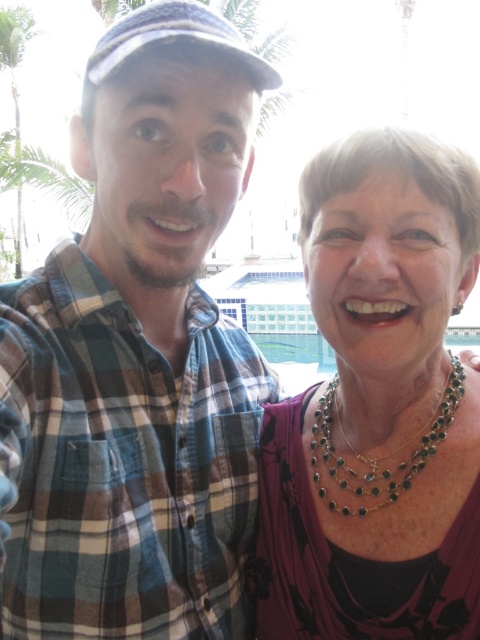
Is plaid fabric shirt at left to the right of multicolored beaded necklace at right from the viewer's perspective?

No, plaid fabric shirt at left is not to the right of multicolored beaded necklace at right.

At what (x,y) coordinates should I click in order to perform the action: click on plaid fabric shirt at left. Please return your answer as a coordinate pair (x, y). Looking at the image, I should click on (136, 355).

The image size is (480, 640). What are the coordinates of `plaid fabric shirt at left` in the screenshot? It's located at (136, 355).

Which is in front, point (9, 412) or point (330, 444)?

Point (9, 412) is in front.

Where is `plaid fabric shirt at left`? The height and width of the screenshot is (640, 480). plaid fabric shirt at left is located at coordinates (136, 355).

Describe the element at coordinates (377, 406) in the screenshot. I see `multicolored beaded necklace at right` at that location.

Which of these two, multicolored beaded necklace at right or green beaded necklace at center, stands shorter?

green beaded necklace at center

Where is `multicolored beaded necklace at right`? multicolored beaded necklace at right is located at coordinates (377, 406).